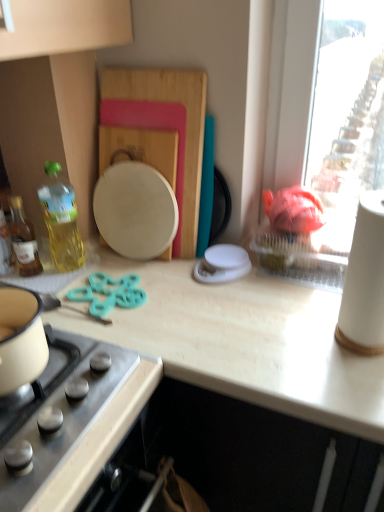
At what (x,y) coordinates should I click in order to perform the action: click on free area in between translucent yellow bottle at left, acting as the 1th bottle starting from the left, and white paper towel at right. Please return your answer as a coordinate pair (x, y). The image size is (384, 512). Looking at the image, I should click on (197, 311).